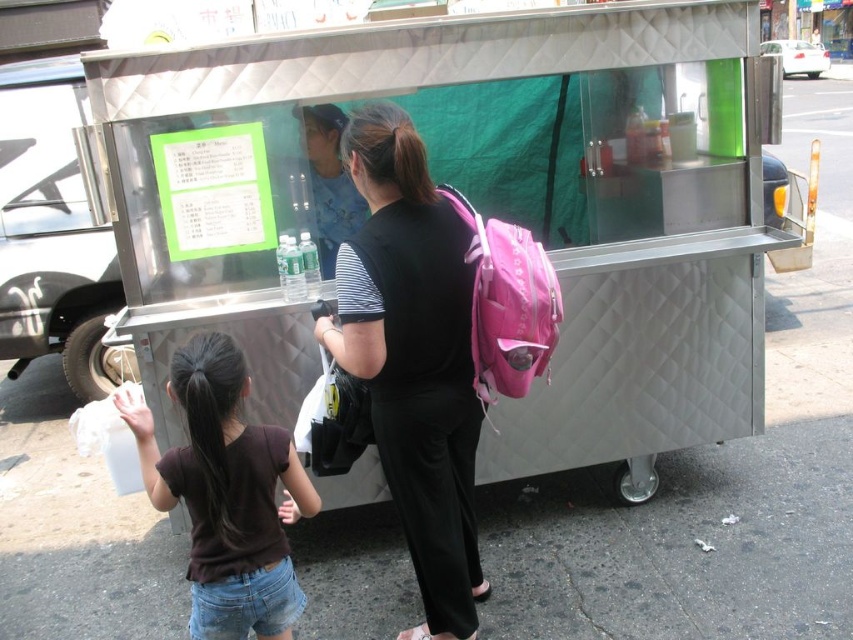
Question: Which object is the closest to the brown cotton shirt at lower left?

Choices:
 (A) stainless steel cart at center
 (B) pink fabric backpack at center

Answer: (B)

Question: Is stainless steel cart at center thinner than pink fabric backpack at center?

Choices:
 (A) no
 (B) yes

Answer: (A)

Question: Does stainless steel cart at center have a larger size compared to pink fabric backpack at center?

Choices:
 (A) yes
 (B) no

Answer: (A)

Question: Which point is farther to the camera?

Choices:
 (A) brown cotton shirt at lower left
 (B) stainless steel cart at center
 (C) pink fabric backpack at center

Answer: (B)

Question: Is stainless steel cart at center positioned before pink fabric backpack at center?

Choices:
 (A) no
 (B) yes

Answer: (A)

Question: Which object is closer to the camera taking this photo?

Choices:
 (A) stainless steel cart at center
 (B) pink fabric backpack at center
 (C) brown cotton shirt at lower left

Answer: (C)